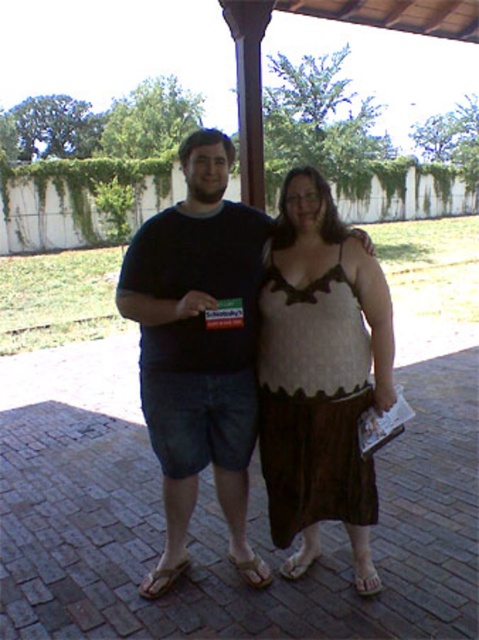
You are a photographer trying to capture a clear shot of the brown textured skirt at center. The camera you are using has a fixed focus point at coordinates 0.5, 0.5. Will the skirt be in focus?

The brown textured skirt at center is located at point (x=198, y=348), which is close to the camera focus point at (x=239, y=320). Therefore, the skirt should be in focus.

You are organizing a fashion show and need to decide which outfit takes up more space on the runway. Based on the image, which item has a greater width between the brown textured skirt at center and the knitted brown dress at center?

The brown textured skirt at center has a greater width than the knitted brown dress at center, so it takes up more space on the runway.

You are a fashion designer observing two outfits at a fashion show. You see a brown textured skirt at center and a knitted brown dress at center. Which outfit has a shorter length?

The brown textured skirt at center is shorter than the knitted brown dress at center.